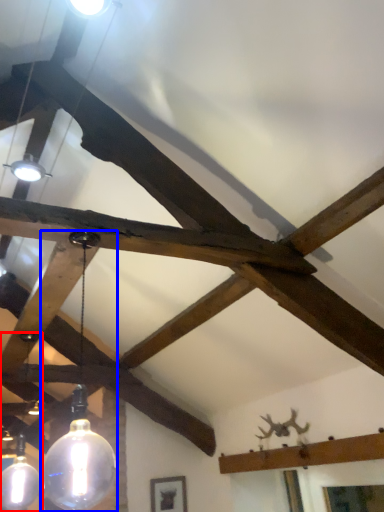
Question: Which of the following is the closest to the observer, lamp (highlighted by a red box) or lamp (highlighted by a blue box)?

Choices:
 (A) lamp
 (B) lamp

Answer: (B)